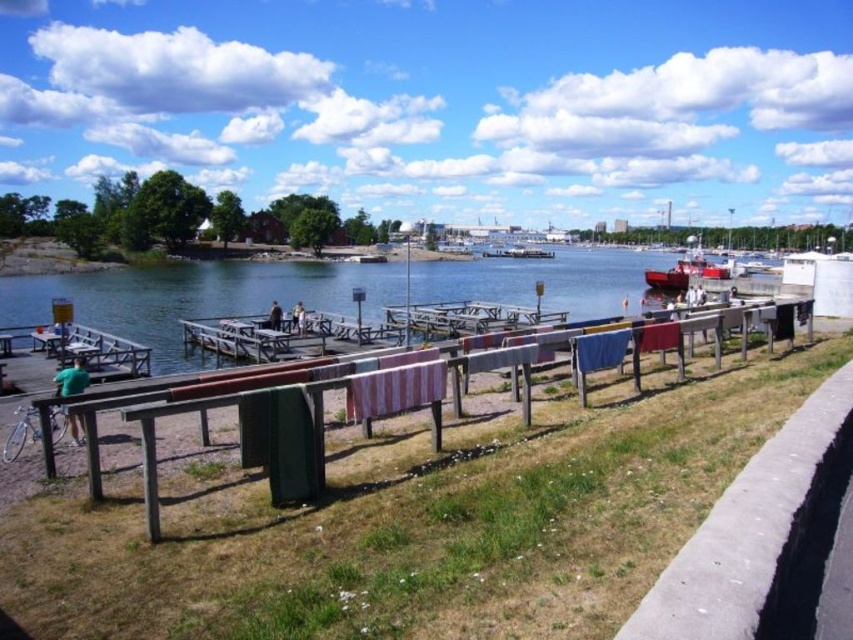
Based on the photo, you are planning to place a small picnic basket on the green grass at lower center. However, there is a white matte boat at center nearby. Based on their positions, will the boat obstruct access to the grass where you want to place the basket?

The green grass at lower center is located below the white matte boat at center, so the boat might block access to the grass. Choose another spot or move the boat to ensure the basket can be placed safely.

You are standing at the edge of the waterfront and want to walk from the green grass at lower center to the clear water at center. Is the path directly between them clear of obstacles?

The green grass at lower center is in front of the clear water at center, so there are no obstacles between them. You can walk directly from the green grass at lower center to the clear water at center without any issues.